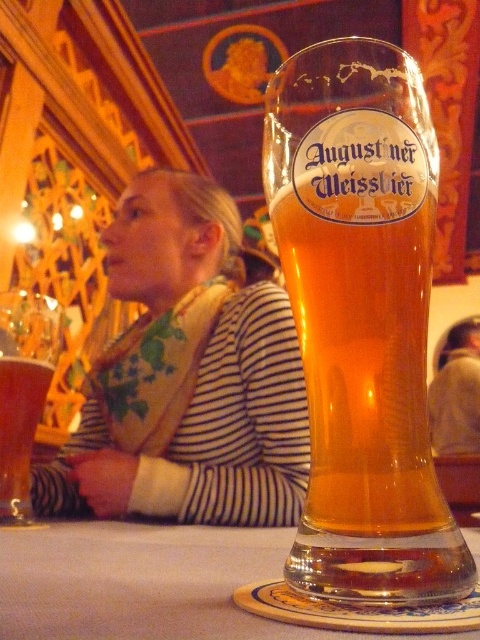
You are a server in a restaurant and need to place a dessert plate on the table. The dessert plate is 20 cm in diameter. Can the dessert plate fit on the white cloth table at center without overlapping the translucent glass beer glass at center?

The translucent glass beer glass at center has a lesser width compared to white cloth table at center. Therefore, the dessert plate with 20 cm diameter can fit on the white cloth table at center as long as it is placed away from the translucent glass beer glass at center.

You are standing in the pub and want to place a small coaster under the translucent glass beer glass at center. If the coaster is 5 cm in diameter, will it fit perfectly under the glass?

The translucent glass beer glass at center is already on a coaster, so there is no need to place another one. However, if you still want to place the coaster, ensure it is at least as wide as the glass base. The current coaster might already be sufficient, but the description does not provide the coaster size.

You are a bartender trying to place a coaster under the translucent glass beer glass at center. The coaster has a diameter of 10 cm. What are the coordinates where you should place the coaster to center it under the glass?

The translucent glass beer glass at center is located at point (361,320), so you should place the coaster at the same coordinates to center it under the glass.